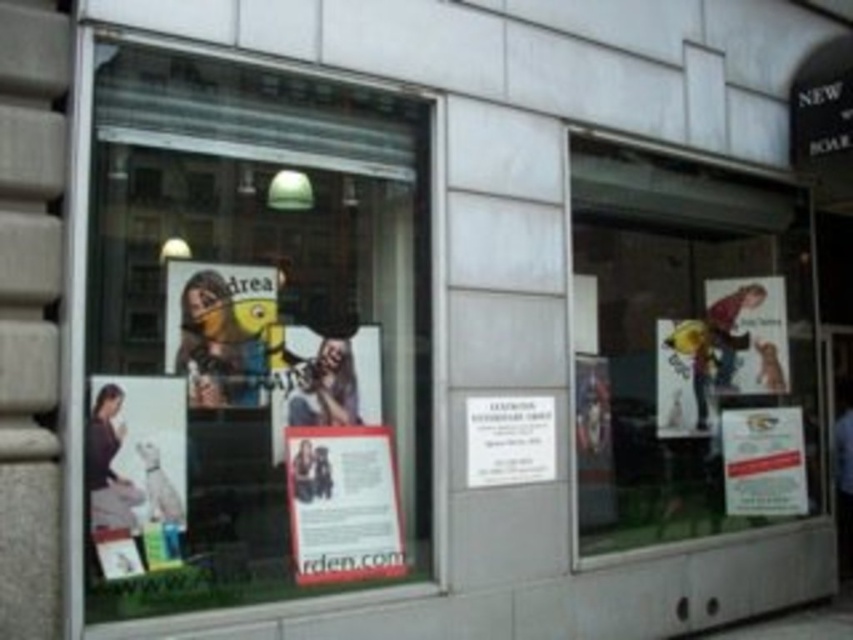
Question: Which of the following is the farthest from the observer?

Choices:
 (A) matte paper poster at lower left
 (B) white paper poster at right
 (C) matte yellow poster at center

Answer: (B)

Question: Is white paper posters at left in front of white paper poster at right?

Choices:
 (A) no
 (B) yes

Answer: (B)

Question: Based on their relative distances, which object is nearer to the smooth blue shirt at center?

Choices:
 (A) matte paper poster at center
 (B) white paper poster at center
 (C) matte paper poster at lower left
 (D) matte white poster at right

Answer: (D)

Question: Where is white paper poster at center located in relation to white paper at center in the image?

Choices:
 (A) left
 (B) right

Answer: (A)

Question: Is white paper posters at left closer to the viewer compared to white paper poster at center?

Choices:
 (A) no
 (B) yes

Answer: (B)

Question: Which object is farther from the camera taking this photo?

Choices:
 (A) white paper poster at center
 (B) matte yellow poster at center
 (C) smooth blue shirt at center
 (D) white paper at center

Answer: (C)